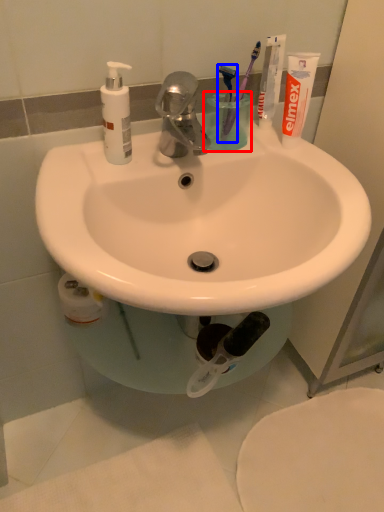
Question: Which object is closer to the camera taking this photo, liquid (highlighted by a red box) or toothbrush (highlighted by a blue box)?

Choices:
 (A) liquid
 (B) toothbrush

Answer: (B)